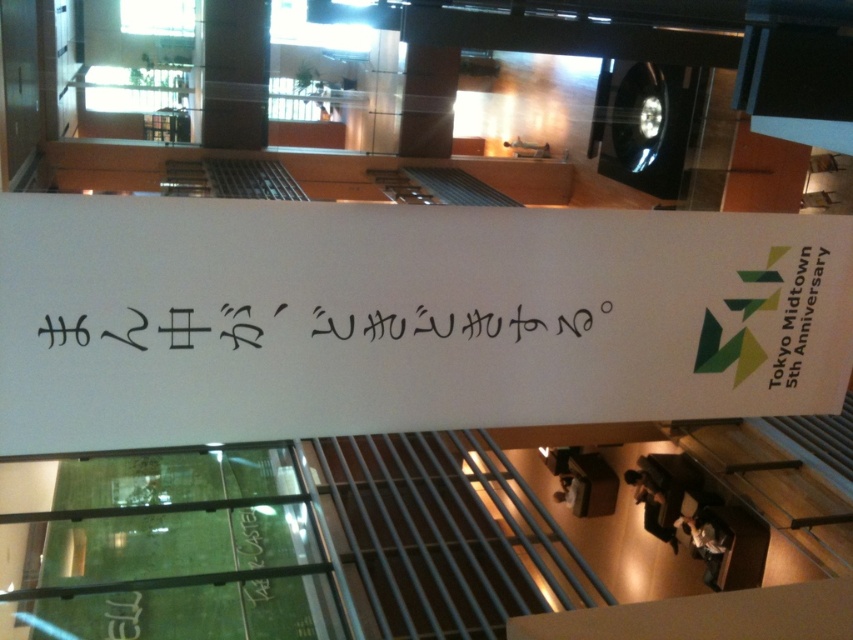
You are a visitor at the Tokyo Midtown event and need to read both the white paper sign at center and the black calligraphy at center. Which one do you think is taller?

The white paper sign at center is taller than the black calligraphy at center.

You are a delivery person who needs to place a small package between the white paper sign at center and the black calligraphy at center. Can you fit the package if it measures 20 centimeters in length?

The distance between the white paper sign at center and the black calligraphy at center is 21.56 centimeters. Since the package is 20 centimeters long, it will fit between them with some space to spare.